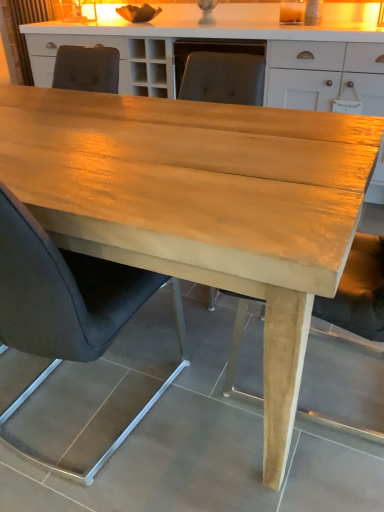
Question: Is black leather chair at center, marked as the second chair in a back-to-front arrangement, oriented away from matte gray chair at center, the first chair viewed from the back?

Choices:
 (A) no
 (B) yes

Answer: (A)

Question: Can you confirm if black leather chair at center, marked as the first chair in a front-to-back arrangement, is thinner than matte gray chair at center, the first chair viewed from the back?

Choices:
 (A) yes
 (B) no

Answer: (A)

Question: Is black leather chair at center, marked as the first chair in a front-to-back arrangement, taller than matte gray chair at center, the 2th chair when ordered from front to back?

Choices:
 (A) no
 (B) yes

Answer: (A)

Question: Is black leather chair at center, marked as the second chair in a back-to-front arrangement, smaller than matte gray chair at center, the 2th chair when ordered from front to back?

Choices:
 (A) yes
 (B) no

Answer: (A)

Question: Does black leather chair at center, marked as the first chair in a front-to-back arrangement, have a greater width compared to matte gray chair at center, the 2th chair when ordered from front to back?

Choices:
 (A) yes
 (B) no

Answer: (B)

Question: From the image's perspective, is matte gray chair at center, the 2th chair when ordered from front to back, located above or below black leather chair at center, marked as the first chair in a front-to-back arrangement?

Choices:
 (A) above
 (B) below

Answer: (A)

Question: Do you think matte gray chair at center, the first chair viewed from the back, is within black leather chair at center, marked as the second chair in a back-to-front arrangement, or outside of it?

Choices:
 (A) inside
 (B) outside

Answer: (B)

Question: In terms of size, does matte gray chair at center, the 2th chair when ordered from front to back, appear bigger or smaller than black leather chair at center, marked as the first chair in a front-to-back arrangement?

Choices:
 (A) big
 (B) small

Answer: (A)

Question: In terms of height, does matte gray chair at center, the 2th chair when ordered from front to back, look taller or shorter compared to black leather chair at center, marked as the first chair in a front-to-back arrangement?

Choices:
 (A) tall
 (B) short

Answer: (A)

Question: From a real-world perspective, is black leather chair at center, marked as the first chair in a front-to-back arrangement, above or below matte brown curtain at upper left?

Choices:
 (A) above
 (B) below

Answer: (B)

Question: Considering the positions of black leather chair at center, marked as the first chair in a front-to-back arrangement, and matte brown curtain at upper left in the image, is black leather chair at center, marked as the first chair in a front-to-back arrangement, taller or shorter than matte brown curtain at upper left?

Choices:
 (A) tall
 (B) short

Answer: (A)

Question: From the image's perspective, is black leather chair at center, marked as the first chair in a front-to-back arrangement, above or below matte brown curtain at upper left?

Choices:
 (A) above
 (B) below

Answer: (B)

Question: Is black leather chair at center, marked as the second chair in a back-to-front arrangement, to the left or to the right of matte brown curtain at upper left in the image?

Choices:
 (A) right
 (B) left

Answer: (A)

Question: Is matte brown curtain at upper left inside or outside of matte gray chair at center, the first chair viewed from the back?

Choices:
 (A) inside
 (B) outside

Answer: (B)

Question: From a real-world perspective, relative to matte gray chair at center, the first chair viewed from the back, is matte brown curtain at upper left vertically above or below?

Choices:
 (A) above
 (B) below

Answer: (A)